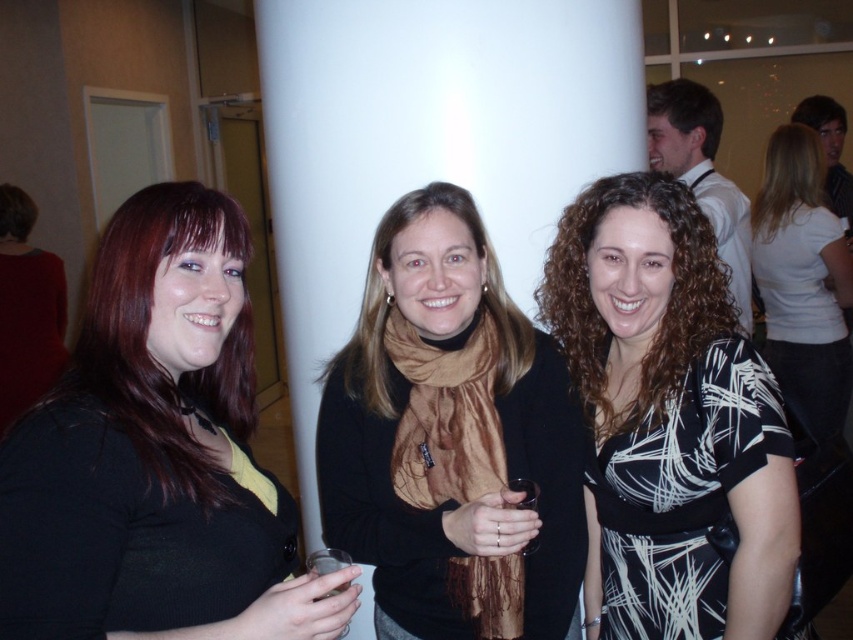
You are at a party and want to hand a drink to the person wearing the matte black sweater at left. Since you are facing the same direction as the group, which side should you approach from to easily reach them without obstructing the view of the brown hair at center?

The matte black sweater at left is positioned on the left side of brown hair at center. To avoid obstructing the view of the brown hair at center, you should approach from the left side of the matte black sweater at left.

You are standing in the room where the three women are posing. You need to locate the brown silk scarf at center. Where exactly is it positioned in the room?

The brown silk scarf at center is located at the coordinates point (451, 438).

You are a photographer at the event and want to ensure that both the matte black sweater at left and the brown hair at center are clearly visible in your photo. Based on their positions, which object should you focus on first to ensure both are in focus?

The matte black sweater at left is below brown hair at center, so focusing on the brown hair at center first will ensure both are in focus since it is higher up and closer to the same plane as the sweater.